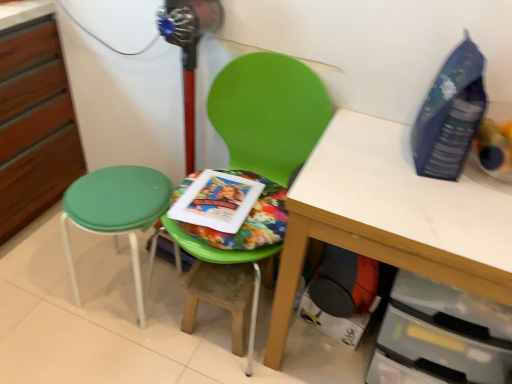
The image size is (512, 384). In order to click on free space above white matte table at center (from a real-world perspective) in this screenshot , I will do `click(417, 185)`.